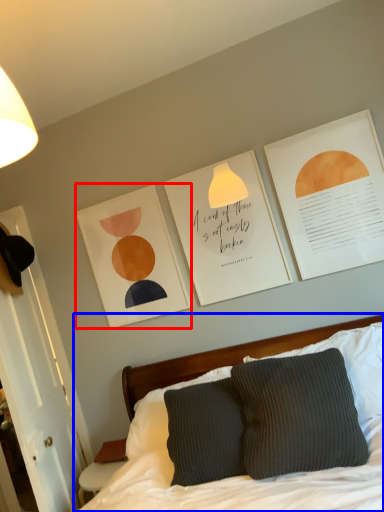
Question: Among these objects, which one is farthest to the camera, picture frame (highlighted by a red box) or bed (highlighted by a blue box)?

Choices:
 (A) picture frame
 (B) bed

Answer: (A)